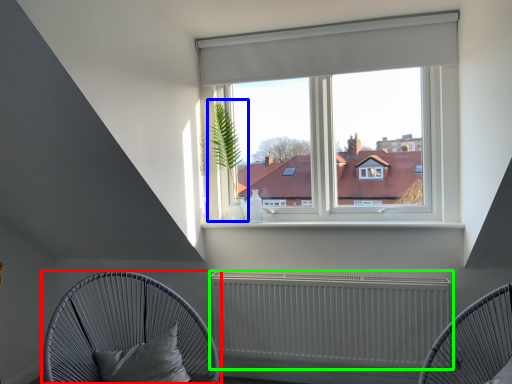
Question: Estimate the real-world distances between objects in this image. Which object is farther from furniture (highlighted by a red box), plant (highlighted by a blue box) or radiator (highlighted by a green box)?

Choices:
 (A) plant
 (B) radiator

Answer: (A)